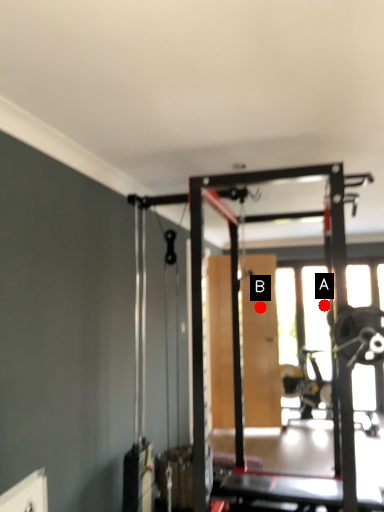
Question: Two points are circled on the image, labeled by A and B beside each circle. Among these points, which one is farthest from the camera?

Choices:
 (A) A is further
 (B) B is further

Answer: (A)